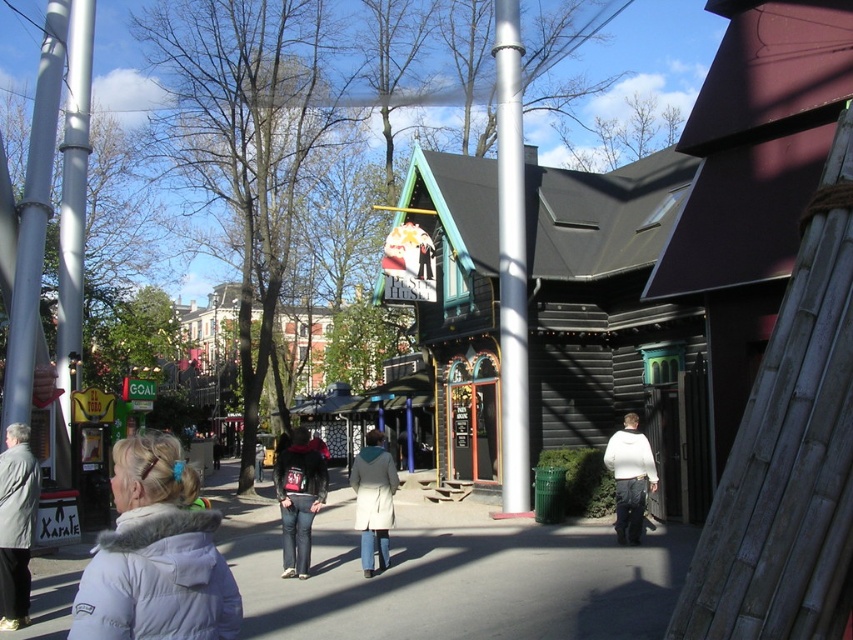
Question: Which is nearer to the white fur-lined coat at lower left?

Choices:
 (A) white matte jacket at lower right
 (B) light beige coat at center
 (C) smooth concrete pavement at center

Answer: (B)

Question: Which point is farther to the camera?

Choices:
 (A) denim jacket at center
 (B) silver metallic pole at center
 (C) light beige coat at center

Answer: (B)

Question: Which of the following is the farthest from the observer?

Choices:
 (A) white fuzzy coat at lower left
 (B) black wooden building at center

Answer: (B)

Question: Is smooth concrete pavement at center closer to the viewer compared to light beige coat at center?

Choices:
 (A) yes
 (B) no

Answer: (A)

Question: Can you confirm if silver metallic pole at left is wider than white fuzzy coat at lower left?

Choices:
 (A) yes
 (B) no

Answer: (A)

Question: Is silver metallic pole at center positioned in front of brushed metal pole at left?

Choices:
 (A) no
 (B) yes

Answer: (A)